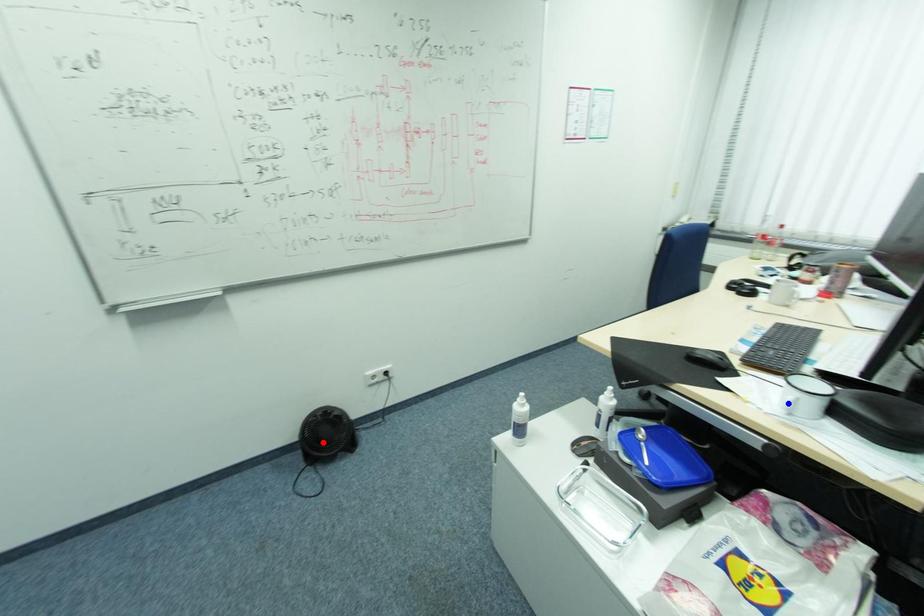
Question: Two points are marked on the image. Which point is closer to the camera?

Choices:
 (A) Blue point is closer.
 (B) Red point is closer.

Answer: (A)